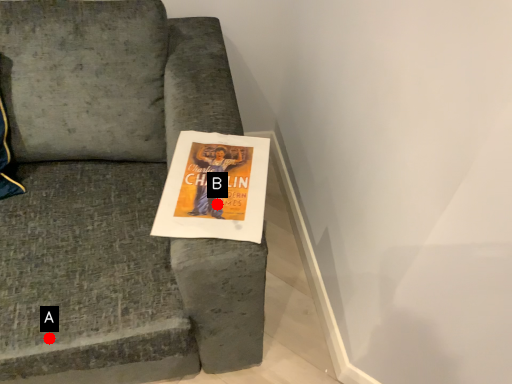
Question: Two points are circled on the image, labeled by A and B beside each circle. Which point is farther from the camera taking this photo?

Choices:
 (A) A is further
 (B) B is further

Answer: (A)